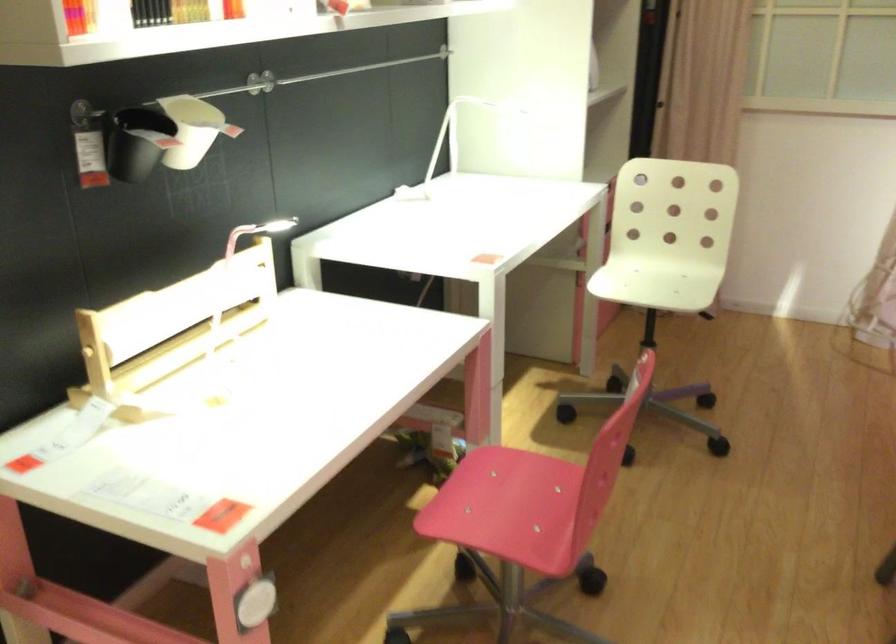
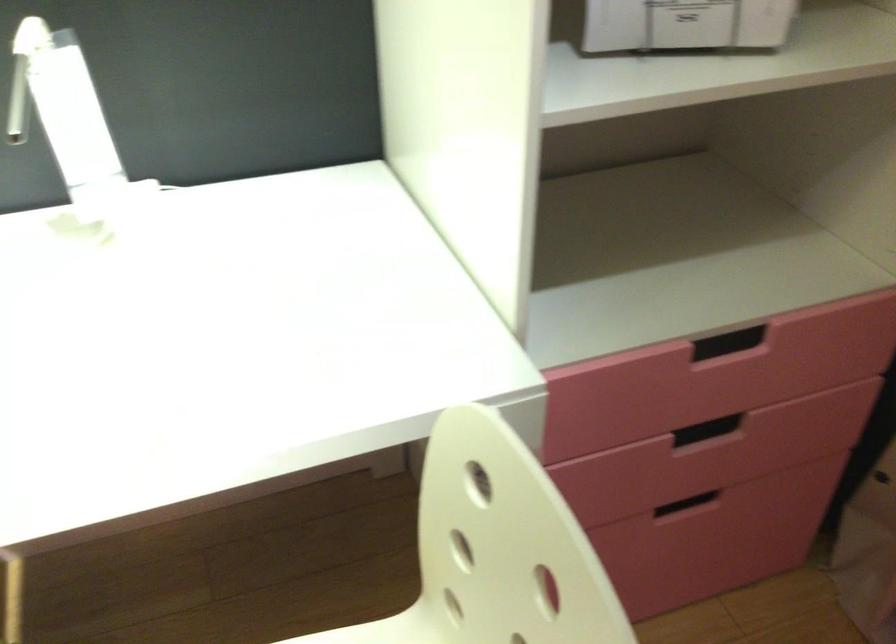
In the second image, find the point that corresponds to [586,80] in the first image.

(685, 24)